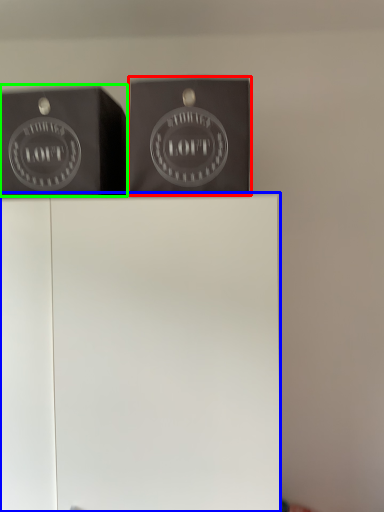
Question: Which is farther away from package (highlighted by a red box)? furniture (highlighted by a blue box) or writing (highlighted by a green box)?

Choices:
 (A) furniture
 (B) writing

Answer: (A)